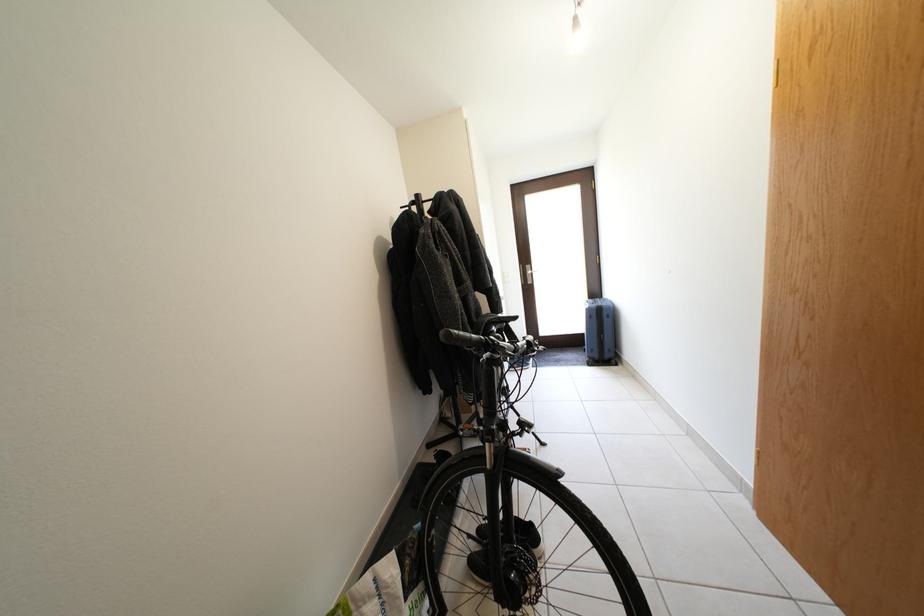
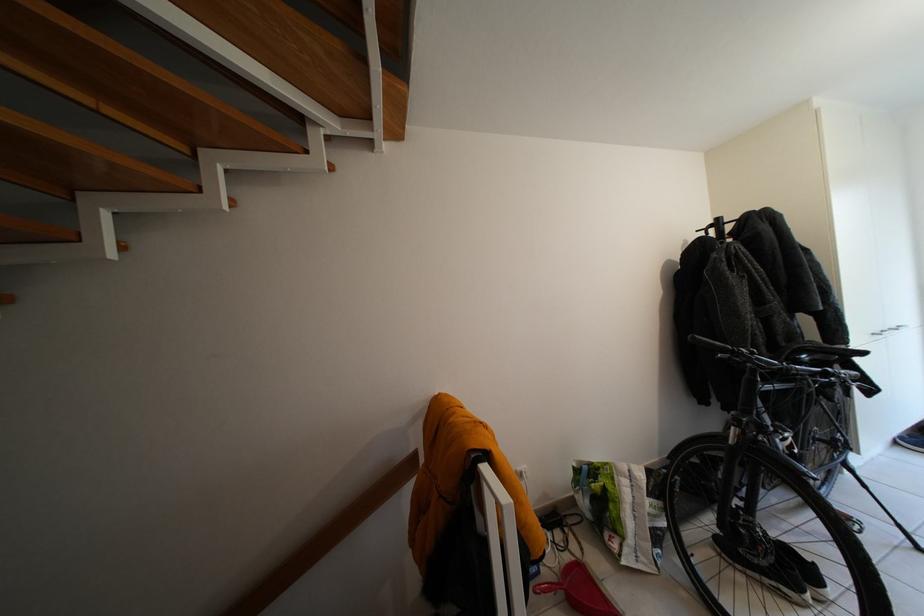
Where in the second image is the point corresponding to (x=512, y=328) from the first image?

(841, 360)